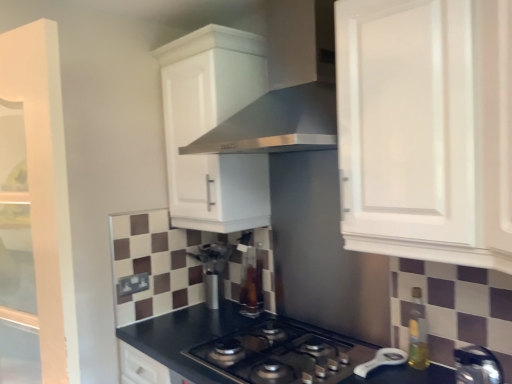
Question: From the image's perspective, is translucent amber bottle at right beneath white matte cabinet at upper right, positioned as the second cabinetry in back-to-front order?

Choices:
 (A) no
 (B) yes

Answer: (B)

Question: Can you confirm if translucent amber bottle at right is bigger than white matte cabinet at upper right, positioned as the second cabinetry in back-to-front order?

Choices:
 (A) yes
 (B) no

Answer: (B)

Question: Is translucent amber bottle at right surrounding white matte cabinet at upper right, placed as the second cabinetry when sorted from left to right?

Choices:
 (A) no
 (B) yes

Answer: (A)

Question: Is translucent amber bottle at right to the right of white matte cabinet at upper right, positioned as the second cabinetry in back-to-front order, from the viewer's perspective?

Choices:
 (A) yes
 (B) no

Answer: (A)

Question: Does translucent amber bottle at right lie behind white matte cabinet at upper right, placed as the second cabinetry when sorted from left to right?

Choices:
 (A) no
 (B) yes

Answer: (B)

Question: Is translucent amber bottle at right next to white matte cabinet at upper right, the 1th cabinetry positioned from the right, and touching it?

Choices:
 (A) yes
 (B) no

Answer: (B)

Question: Is transparent glass bottle at center, which ranks as the second appliance in front-to-back order, not inside translucent amber bottle at right?

Choices:
 (A) yes
 (B) no

Answer: (A)

Question: Can you confirm if transparent glass bottle at center, marked as the first appliance in a left-to-right arrangement, is bigger than translucent amber bottle at right?

Choices:
 (A) yes
 (B) no

Answer: (A)

Question: Does transparent glass bottle at center, the first appliance when ordered from back to front, come behind translucent amber bottle at right?

Choices:
 (A) no
 (B) yes

Answer: (B)

Question: Is transparent glass bottle at center, which is the 2th appliance from right to left, in contact with translucent amber bottle at right?

Choices:
 (A) yes
 (B) no

Answer: (B)

Question: Does transparent glass bottle at center, marked as the first appliance in a left-to-right arrangement, have a lesser width compared to translucent amber bottle at right?

Choices:
 (A) yes
 (B) no

Answer: (A)

Question: From a real-world perspective, is transparent glass bottle at center, which ranks as the second appliance in front-to-back order, below translucent amber bottle at right?

Choices:
 (A) no
 (B) yes

Answer: (A)

Question: Does metallic silver kettle at lower right, marked as the 2th appliance in a back-to-front arrangement, have a lesser width compared to satin silver vent at upper center?

Choices:
 (A) yes
 (B) no

Answer: (A)